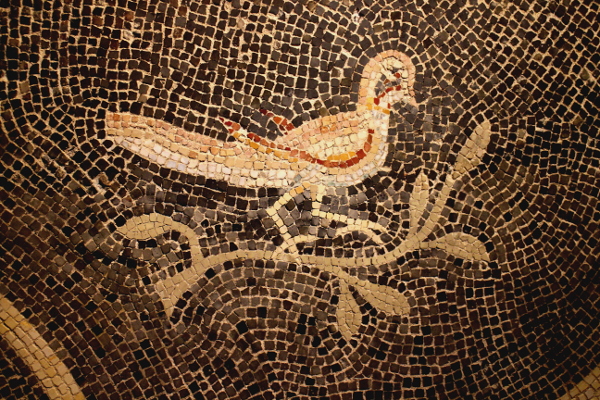
The width and height of the screenshot is (600, 400). What are the coordinates of `white tile` in the screenshot? It's located at [x=127, y=39].